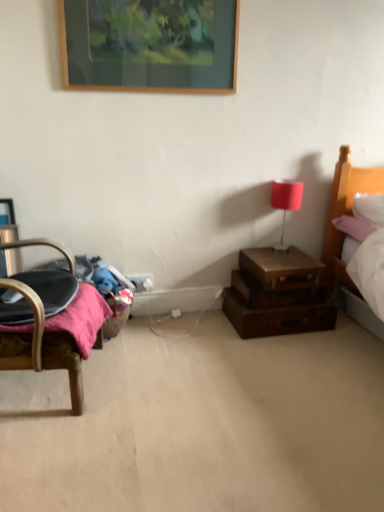
Question: Looking at the image, does brown leather suitcase at right seem bigger or smaller compared to matte red table lamp at upper right?

Choices:
 (A) big
 (B) small

Answer: (A)

Question: From the image's perspective, is brown leather suitcase at right located above or below matte red table lamp at upper right?

Choices:
 (A) below
 (B) above

Answer: (A)

Question: Which is nearer to the brown wooden drawers at lower right?

Choices:
 (A) brown leather suitcase at lower right
 (B) matte red table lamp at upper right
 (C) wooden picture frame at upper center
 (D) brown leather suitcase at right
 (E) white plastic electric outlet at lower center

Answer: (A)

Question: Considering the real-world distances, which object is farthest from the white plastic electric outlet at lower center?

Choices:
 (A) brown leather suitcase at right
 (B) matte red table lamp at upper right
 (C) brown leather suitcase at lower right
 (D) wooden picture frame at upper center
 (E) brown wooden drawers at lower right

Answer: (D)